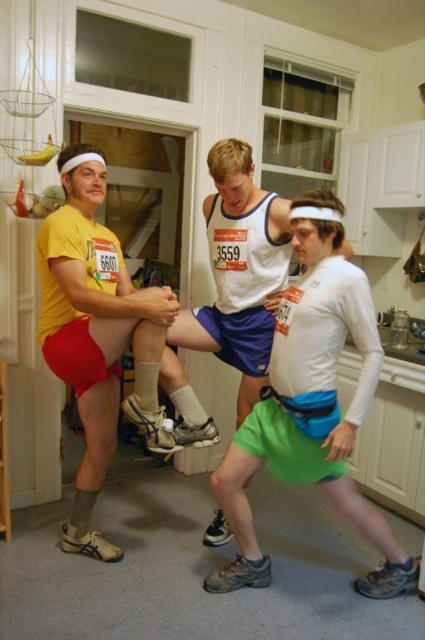
Is green fabric shorts at center above matte yellow t-shirt at left?

No.

Between point (306, 269) and point (82, 145), which one is positioned behind?

Point (306, 269)

Describe the element at coordinates (311, 404) in the screenshot. This screenshot has width=425, height=640. I see `green fabric shorts at center` at that location.

Find the location of a particular element. This screenshot has width=425, height=640. green fabric shorts at center is located at coordinates (311, 404).